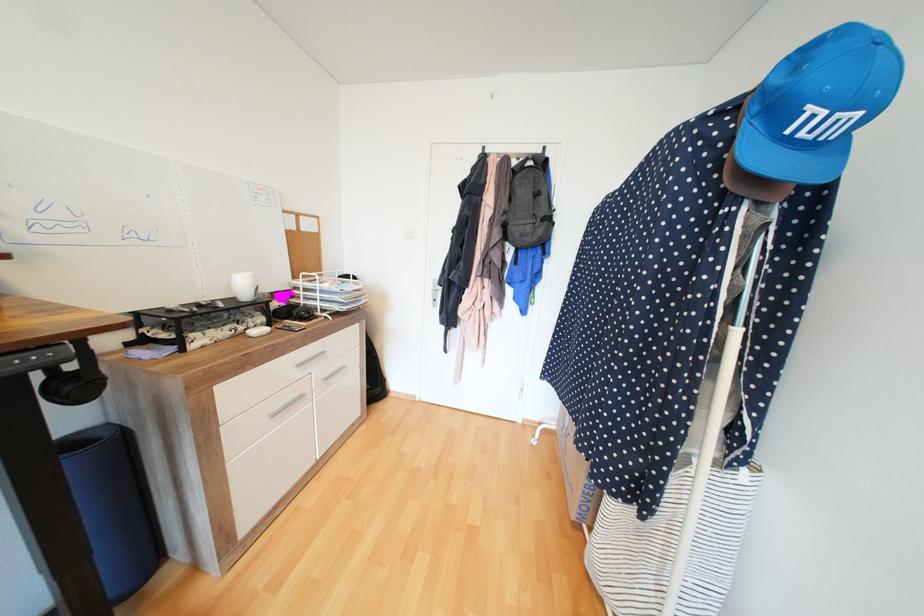
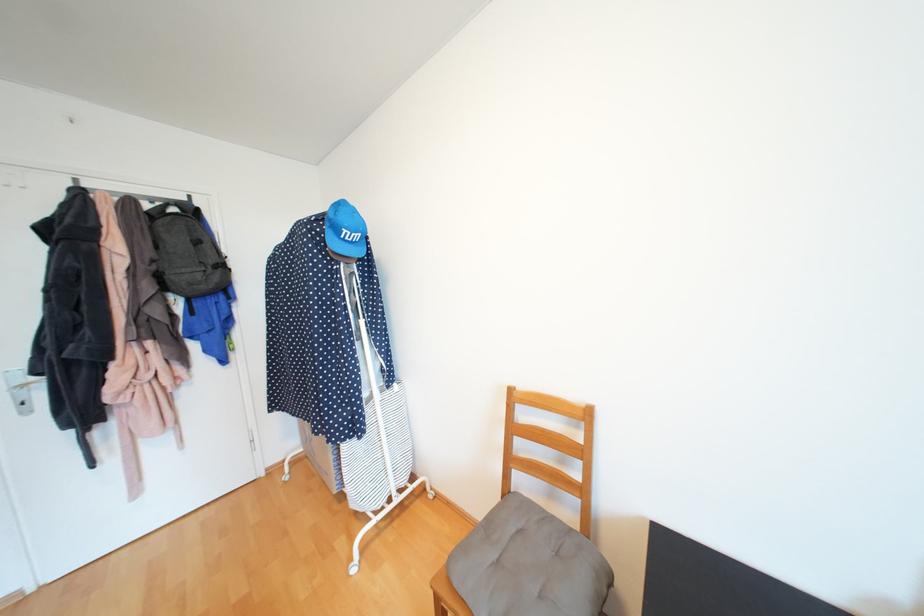
Question: The camera is either moving clockwise (left) or counter-clockwise (right) around the object. The first image is from the beginning of the video and the second image is from the end. Is the camera moving left or right when shooting the video?

Choices:
 (A) Left
 (B) Right

Answer: (A)